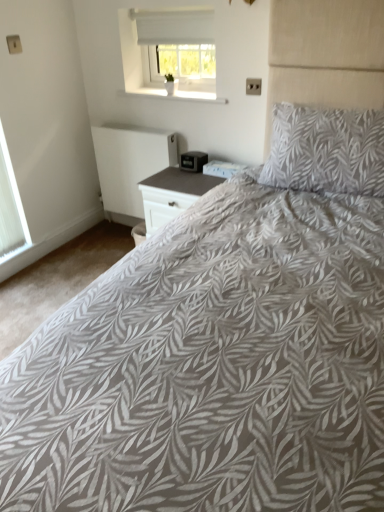
Question: From a real-world perspective, does white matte radiator at lower left sit lower than white textured window at left, the 2th window from the top?

Choices:
 (A) yes
 (B) no

Answer: (A)

Question: Can you confirm if white matte radiator at lower left is taller than white textured window at left, positioned as the second window in right-to-left order?

Choices:
 (A) no
 (B) yes

Answer: (A)

Question: Is white matte radiator at lower left oriented towards white textured window at left, which is the 1th window in bottom-to-top order?

Choices:
 (A) no
 (B) yes

Answer: (B)

Question: Considering the relative positions of white matte radiator at lower left and white textured window at left, positioned as the second window in right-to-left order, in the image provided, is white matte radiator at lower left to the left of white textured window at left, positioned as the second window in right-to-left order, from the viewer's perspective?

Choices:
 (A) no
 (B) yes

Answer: (A)

Question: Is white matte radiator at lower left closer to camera compared to white textured window at left, positioned as the second window in right-to-left order?

Choices:
 (A) no
 (B) yes

Answer: (A)

Question: From the image's perspective, is white textured window at left, positioned as the second window in right-to-left order, positioned above or below white matte radiator at lower left?

Choices:
 (A) above
 (B) below

Answer: (B)

Question: Visually, is white textured window at left, positioned as the second window in right-to-left order, positioned to the left or to the right of white matte radiator at lower left?

Choices:
 (A) right
 (B) left

Answer: (B)

Question: Considering the positions of white textured window at left, the 2th window from the top, and white matte radiator at lower left in the image, is white textured window at left, the 2th window from the top, taller or shorter than white matte radiator at lower left?

Choices:
 (A) short
 (B) tall

Answer: (B)

Question: Is white textured window at left, which is the 1th window in bottom-to-top order, inside the boundaries of white matte radiator at lower left, or outside?

Choices:
 (A) inside
 (B) outside

Answer: (B)

Question: Is white textured window at left, positioned as the second window in right-to-left order, inside or outside of white matte window at upper center, arranged as the 1th window when viewed from the right?

Choices:
 (A) outside
 (B) inside

Answer: (A)

Question: Relative to white matte window at upper center, the second window viewed from the left, is white textured window at left, which is the 1th window in bottom-to-top order, in front or behind?

Choices:
 (A) behind
 (B) front

Answer: (B)

Question: Does point (8, 232) appear closer or farther from the camera than point (203, 12)?

Choices:
 (A) closer
 (B) farther

Answer: (B)

Question: From the image's perspective, is white textured window at left, the first window in the left-to-right sequence, above or below white matte window at upper center, which is counted as the second window, starting from the bottom?

Choices:
 (A) below
 (B) above

Answer: (A)

Question: Considering the relative positions of gray leaf-patterned pillow at upper right and white matte window at upper center, the second window viewed from the left, in the image provided, is gray leaf-patterned pillow at upper right to the left or to the right of white matte window at upper center, the second window viewed from the left,?

Choices:
 (A) left
 (B) right

Answer: (B)

Question: From the image's perspective, relative to white matte window at upper center, arranged as the 1th window when viewed from the right, is gray leaf-patterned pillow at upper right above or below?

Choices:
 (A) above
 (B) below

Answer: (B)